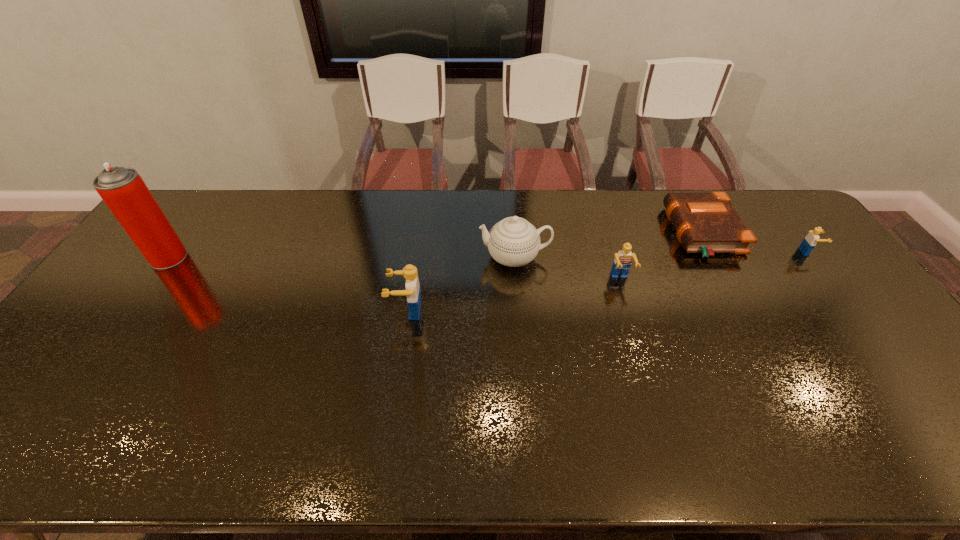
Find the location of a particular element. This screenshot has width=960, height=540. the shortest object is located at coordinates (707, 223).

Image resolution: width=960 pixels, height=540 pixels. I want to click on free location located on the face of the second object from left to right, so click(344, 311).

This screenshot has width=960, height=540. Identify the location of free space located on the face of the second object from left to right. (316, 311).

You are a GUI agent. You are given a task and a screenshot of the screen. Output one action in this format:
    pyautogui.click(x=<x>, y=<y>)
    Task: Click on the free location located on the face of the second object from left to right
    
    Given the screenshot: What is the action you would take?
    pyautogui.click(x=273, y=311)

Where is `free point located on the face of the second farthest Lego`? This screenshot has width=960, height=540. free point located on the face of the second farthest Lego is located at coordinates (661, 415).

I want to click on vacant space located on the right of the tallest object, so click(x=230, y=258).

Find the location of a particular element. The width and height of the screenshot is (960, 540). vacant space located on the spout of the chinaware is located at coordinates (399, 257).

You are a GUI agent. You are given a task and a screenshot of the screen. Output one action in this format:
    pyautogui.click(x=<x>, y=<y>)
    Task: Click on the free space located on the spout of the chinaware
    The image size is (960, 540).
    Given the screenshot: What is the action you would take?
    pyautogui.click(x=399, y=257)

You are a GUI agent. You are given a task and a screenshot of the screen. Output one action in this format:
    pyautogui.click(x=<x>, y=<y>)
    Task: Click on the vacant space positioned 0.220m on the spout of the chinaware
    The height and width of the screenshot is (540, 960).
    Given the screenshot: What is the action you would take?
    pyautogui.click(x=409, y=257)

Where is `free space located on the spine side of the fifth object from left to right`? The width and height of the screenshot is (960, 540). free space located on the spine side of the fifth object from left to right is located at coordinates point(550,233).